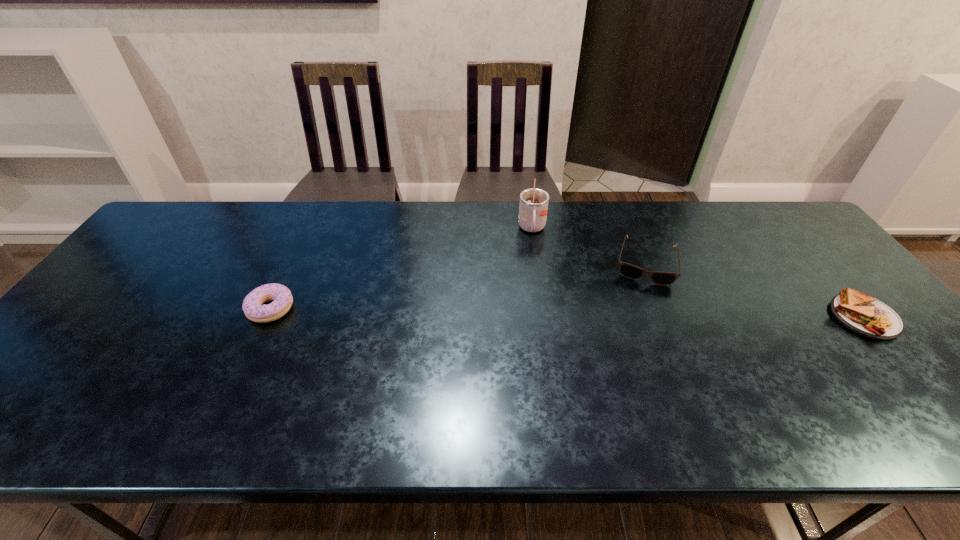
Where is `free point between the third object from left to right and the leftmost object`? The image size is (960, 540). free point between the third object from left to right and the leftmost object is located at coordinates (458, 286).

Identify the location of vacant space in between the doughnut and the third object from left to right. (458, 286).

The height and width of the screenshot is (540, 960). Identify the location of free space between the sandwich and the sunglasses. (755, 291).

This screenshot has width=960, height=540. I want to click on free spot between the rightmost object and the sunglasses, so click(755, 291).

Locate an element on the screen. The height and width of the screenshot is (540, 960). vacant area that lies between the second object from left to right and the sunglasses is located at coordinates (588, 246).

Where is `free space that is in between the leftmost object and the sunglasses`? free space that is in between the leftmost object and the sunglasses is located at coordinates (458, 286).

At what (x,y) coordinates should I click in order to perform the action: click on vacant area that lies between the doughnut and the second object from right to left. Please return your answer as a coordinate pair (x, y). Looking at the image, I should click on (458, 286).

Where is `free space between the leftmost object and the sandwich`? The height and width of the screenshot is (540, 960). free space between the leftmost object and the sandwich is located at coordinates (567, 313).

Where is `free space between the second object from left to right and the leftmost object`? free space between the second object from left to right and the leftmost object is located at coordinates (401, 269).

The width and height of the screenshot is (960, 540). Identify the location of unoccupied position between the leftmost object and the rightmost object. (567, 313).